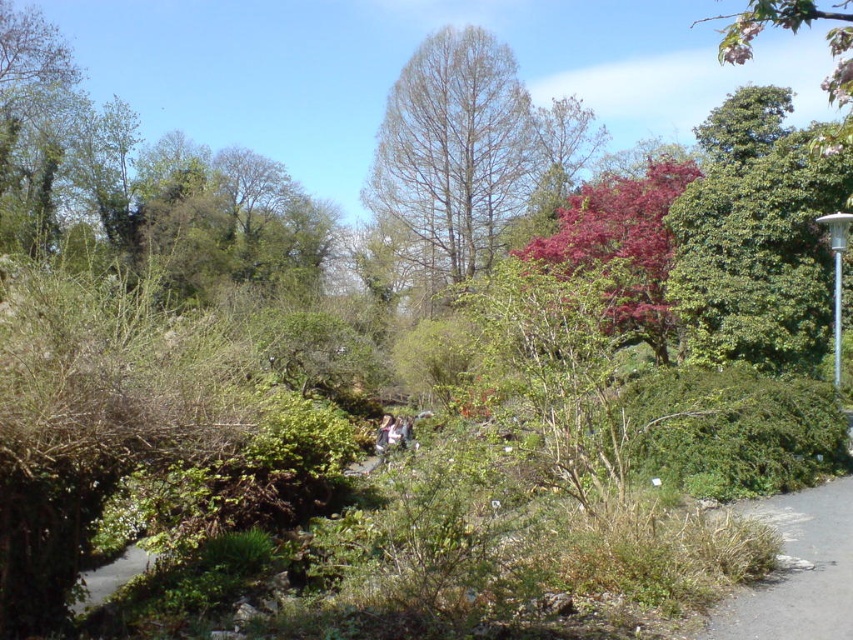
You are a photographer standing at the center of the scene. You want to take a photo that includes both the bare branches tree at center and the light brown hair at center. Which object should you focus on first if you want to ensure both are in clear view?

The bare branches tree at center is larger in size than the light brown hair at center, so you should focus on the bare branches tree at center first to ensure both are in clear view.

You are planning a walking route through the botanical garden and see the gray asphalt path at lower right and the light brown hair at center. Which of these two objects is larger in the image?

The light brown hair at center is larger than the gray asphalt path at lower right in the image.

You are a photographer trying to capture a photo of the bare branches tree at center and the light brown leather jacket at center. Which object will appear larger in your photo?

The bare branches tree at center will appear larger in the photo because it is bigger than the light brown leather jacket at center.